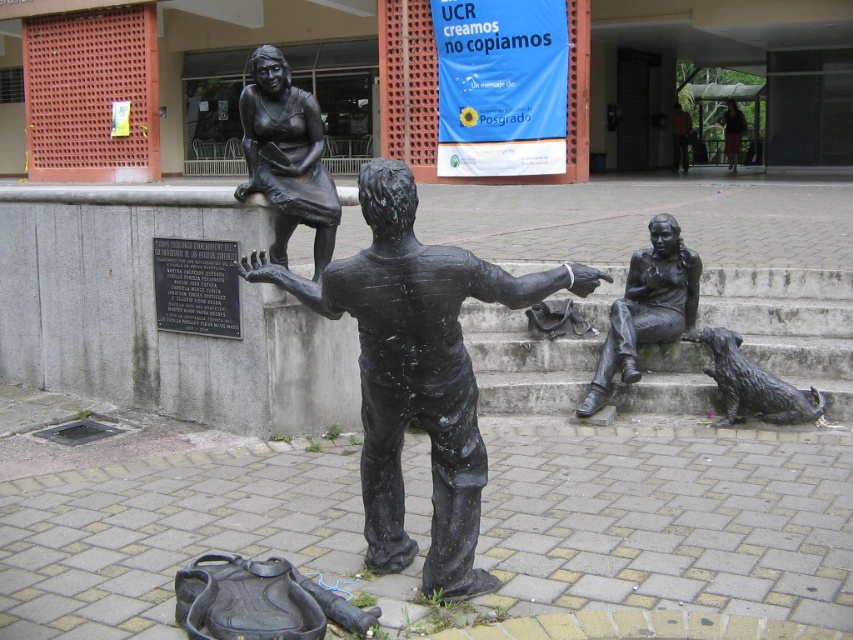
Question: Considering the relative positions of bronze statue of woman at upper left and bronze statue of woman at center in the image provided, where is bronze statue of woman at upper left located with respect to bronze statue of woman at center?

Choices:
 (A) right
 (B) left

Answer: (B)

Question: Which point is farther from the camera taking this photo?

Choices:
 (A) (808, 417)
 (B) (738, 147)

Answer: (B)

Question: Does bronze statue at center appear under bronze statue of woman sitting at right?

Choices:
 (A) no
 (B) yes

Answer: (B)

Question: Is bronze statue of woman at upper left to the right of shiny bronze dog at lower right from the viewer's perspective?

Choices:
 (A) yes
 (B) no

Answer: (B)

Question: Estimate the real-world distances between objects in this image. Which object is farther from the bronze statue of woman sitting at right?

Choices:
 (A) bronze statue of woman at upper left
 (B) shiny bronze dog at lower right
 (C) dark brown statue at center
 (D) bronze statue of woman at center

Answer: (D)

Question: Which is farther from the dark brown statue at center?

Choices:
 (A) bronze statue of woman at center
 (B) shiny bronze dog at lower right
 (C) bronze statue at center

Answer: (C)